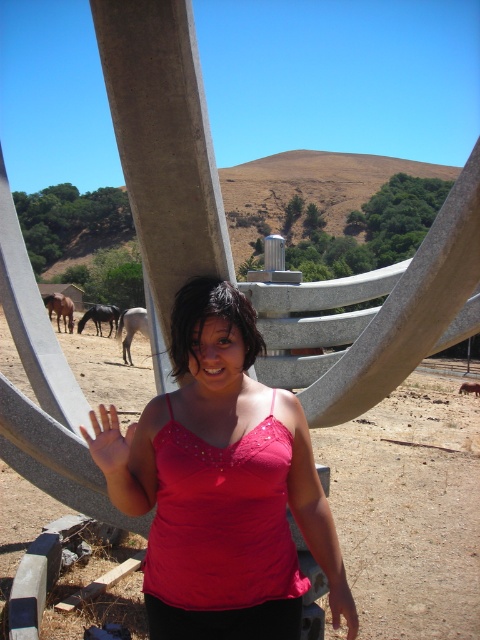
Question: Is matte pink tank top at center further to camera compared to brown glossy horse at left?

Choices:
 (A) yes
 (B) no

Answer: (B)

Question: Which of the following is the farthest from the observer?

Choices:
 (A) brown horse at center
 (B) white glossy horse at center
 (C) pink fabric hand at center

Answer: (B)

Question: Which of the following is the closest to the observer?

Choices:
 (A) matte pink fabric at center
 (B) white glossy horse at center
 (C) matte pink tank top at center
 (D) dark brown horse at center

Answer: (A)

Question: Can you confirm if brown glossy horse at left is positioned above brown horse at center?

Choices:
 (A) no
 (B) yes

Answer: (B)

Question: Is matte pink fabric at center behind brown glossy horse at left?

Choices:
 (A) yes
 (B) no

Answer: (B)

Question: Which point is closer to the camera?

Choices:
 (A) matte pink fabric at center
 (B) brown glossy horse at left
 (C) dark brown horse at center
 (D) brown horse at center

Answer: (A)